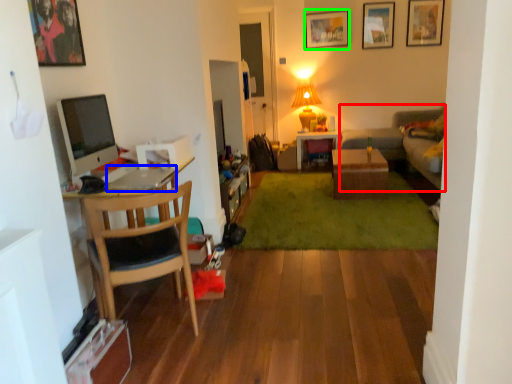
Question: Which is farther away from couch (highlighted by a red box)? laptop (highlighted by a blue box) or picture frame (highlighted by a green box)?

Choices:
 (A) laptop
 (B) picture frame

Answer: (A)